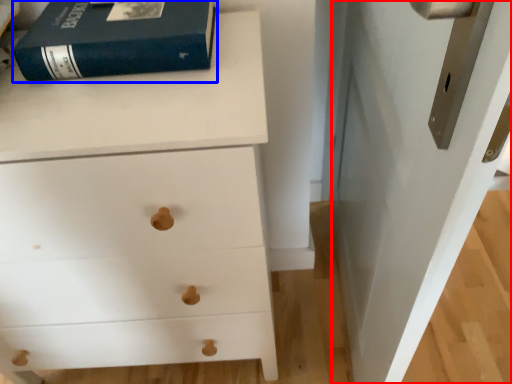
Question: Which of the following is the closest to the observer, door (highlighted by a red box) or paperback book (highlighted by a blue box)?

Choices:
 (A) door
 (B) paperback book

Answer: (A)